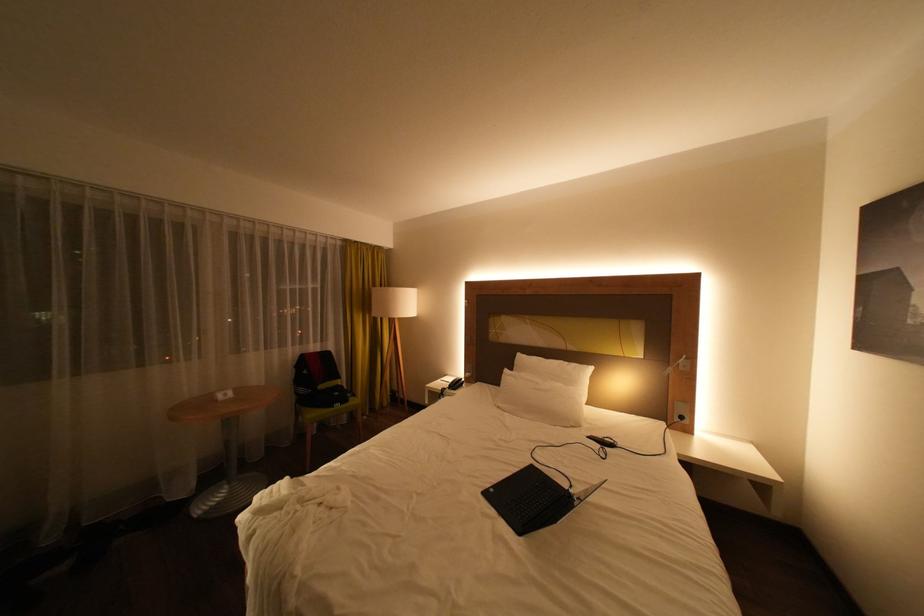
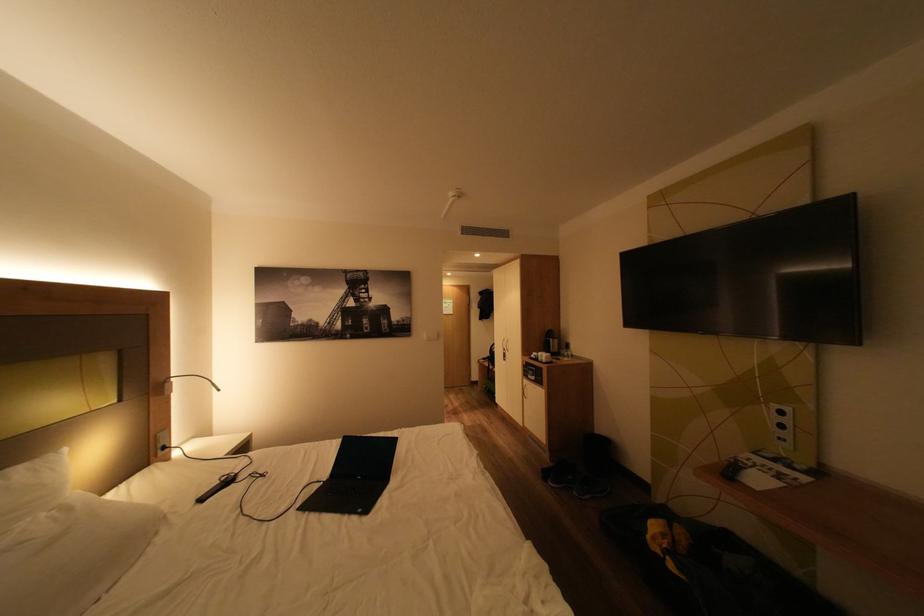
In the second image, find the point that corresponds to [596,367] in the first image.

(62, 455)